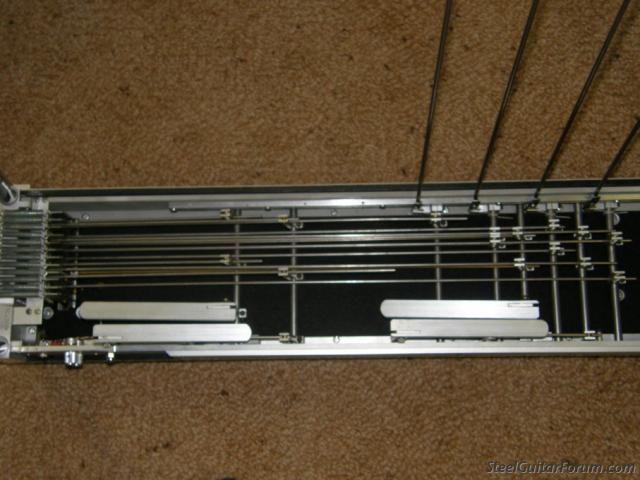
Locate an element on the screen. The image size is (640, 480). screws is located at coordinates (70, 358).